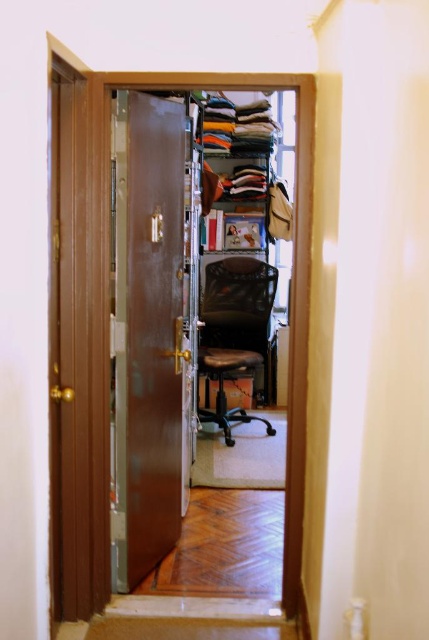
Question: Can you confirm if matte brown closet at center is smaller than brown wood door at left?

Choices:
 (A) no
 (B) yes

Answer: (A)

Question: Which object appears closest to the camera in this image?

Choices:
 (A) matte brown closet at center
 (B) brown wood door at left
 (C) black mesh swivel chair at center

Answer: (B)

Question: Estimate the real-world distances between objects in this image. Which object is farther from the matte brown closet at center?

Choices:
 (A) black mesh swivel chair at center
 (B) brown polished wood door at center
 (C) brown wood door at left

Answer: (C)

Question: Which point is farther to the camera?

Choices:
 (A) (223, 403)
 (B) (142, 326)
 (C) (72, 602)

Answer: (A)

Question: Is matte brown closet at center below brown wood door at left?

Choices:
 (A) no
 (B) yes

Answer: (A)

Question: Does matte brown closet at center have a smaller size compared to brown wood door at left?

Choices:
 (A) no
 (B) yes

Answer: (A)